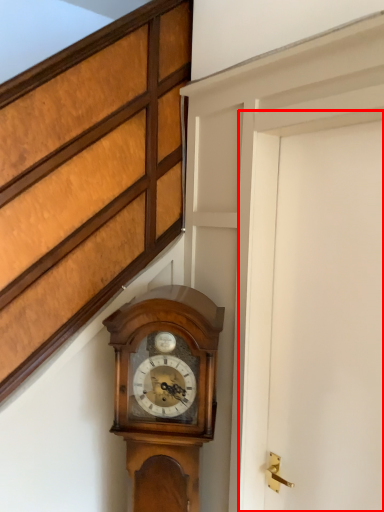
Question: From the image's perspective, what is the correct spatial positioning of door (annotated by the red box) in reference to wall clock?

Choices:
 (A) above
 (B) below

Answer: (A)